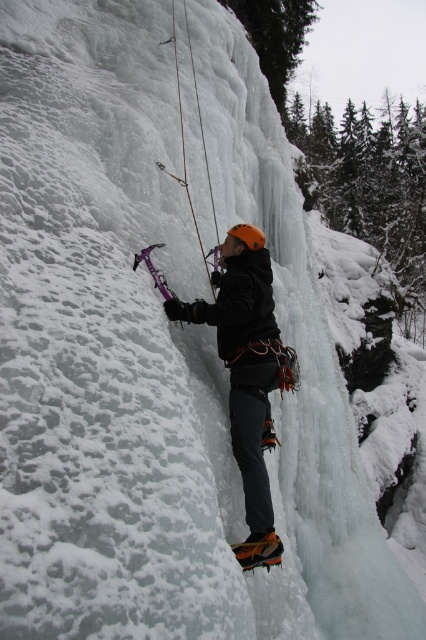
Question: Among these points, which one is nearest to the camera?

Choices:
 (A) (227, 362)
 (B) (247, 224)

Answer: (A)

Question: Among these objects, which one is nearest to the camera?

Choices:
 (A) matte black jacket at center
 (B) orange matte helmet at center

Answer: (A)

Question: Can you confirm if matte black jacket at center is smaller than orange matte helmet at center?

Choices:
 (A) no
 (B) yes

Answer: (A)

Question: Can you confirm if matte black jacket at center is positioned to the left of orange matte helmet at center?

Choices:
 (A) no
 (B) yes

Answer: (B)

Question: Is matte black jacket at center positioned before orange matte helmet at center?

Choices:
 (A) no
 (B) yes

Answer: (B)

Question: Which point is farther from the camera taking this photo?

Choices:
 (A) (247, 548)
 (B) (253, 234)

Answer: (B)